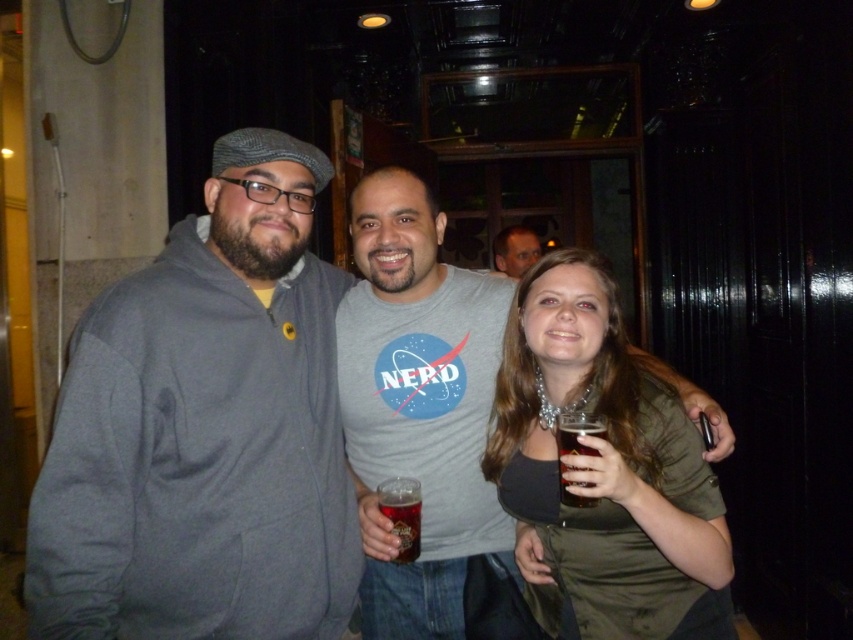
Between green matte shirt at center and translucent glass mug at center, which one has more height?

green matte shirt at center

Is point (532, 516) positioned before point (415, 554)?

That is True.

I want to click on green matte shirt at center, so click(x=602, y=470).

Where is `gray fleece jacket at left`? gray fleece jacket at left is located at coordinates (204, 429).

Can you confirm if gray fleece jacket at left is positioned to the right of matte gray shirt at center?

In fact, gray fleece jacket at left is to the left of matte gray shirt at center.

Measure the distance between gray fleece jacket at left and camera.

The distance of gray fleece jacket at left from camera is 1.08 meters.

Locate an element on the screen. This screenshot has width=853, height=640. gray fleece jacket at left is located at coordinates (204, 429).

Does green matte shirt at center have a greater height compared to matte gray shirt at center?

Yes.

Between green matte shirt at center and matte gray shirt at center, which one appears on the right side from the viewer's perspective?

Positioned to the right is matte gray shirt at center.

Where is `green matte shirt at center`? The height and width of the screenshot is (640, 853). green matte shirt at center is located at coordinates (602, 470).

Locate an element on the screen. This screenshot has height=640, width=853. green matte shirt at center is located at coordinates (602, 470).